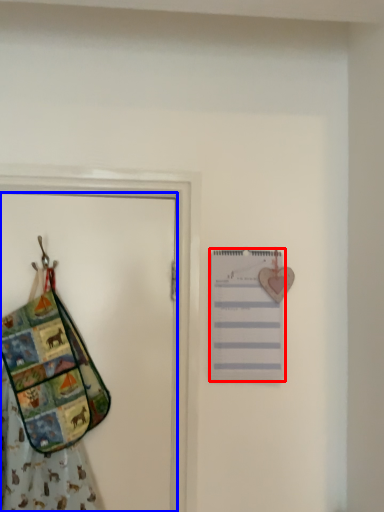
Question: Among these objects, which one is nearest to the camera, list (highlighted by a red box) or door (highlighted by a blue box)?

Choices:
 (A) list
 (B) door

Answer: (B)